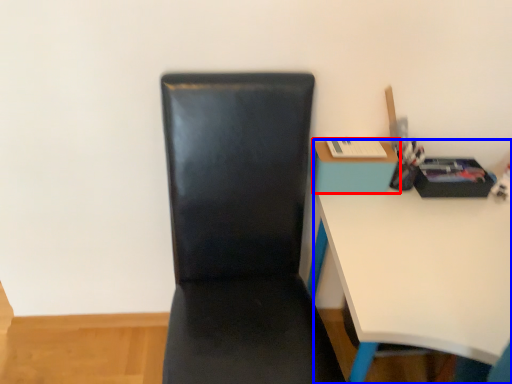
Question: Which object appears closest to the camera in this image, table (highlighted by a red box) or desk (highlighted by a blue box)?

Choices:
 (A) table
 (B) desk

Answer: (B)